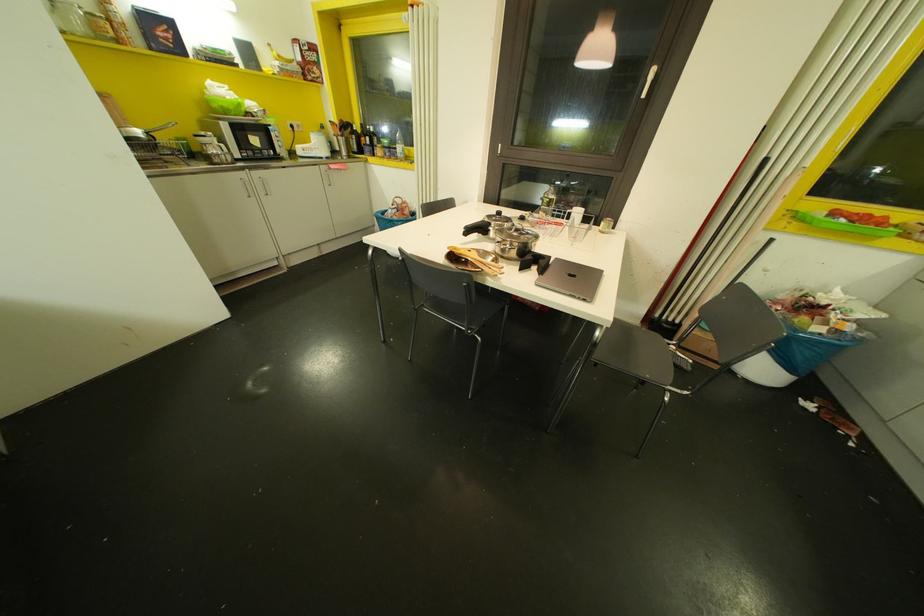
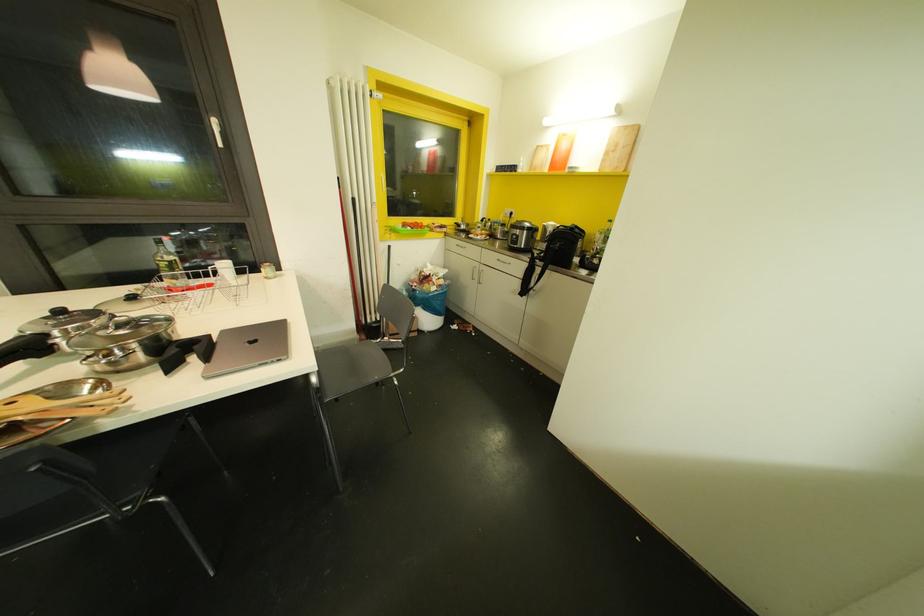
Locate, in the second image, the point that corresponds to pixel 550 199 in the first image.

(169, 262)